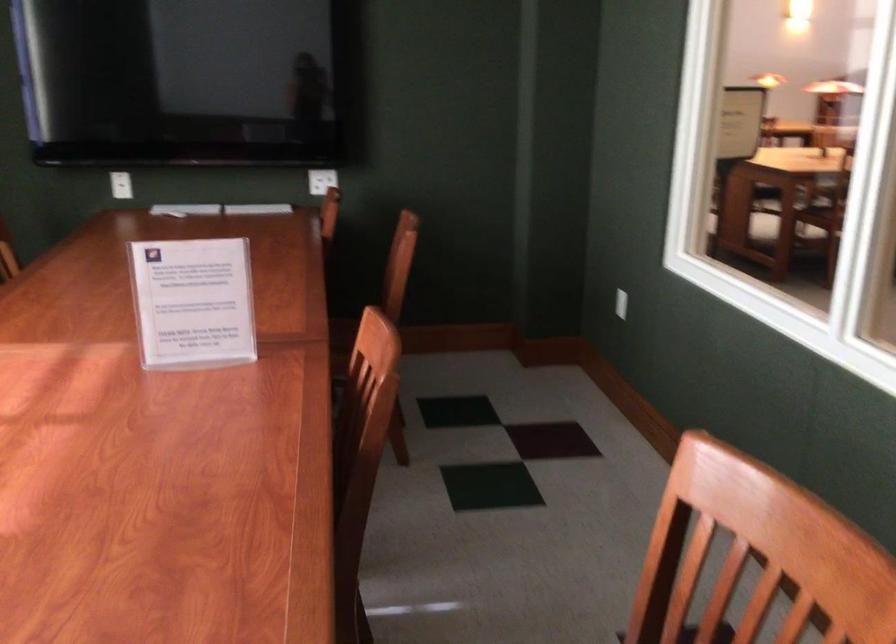
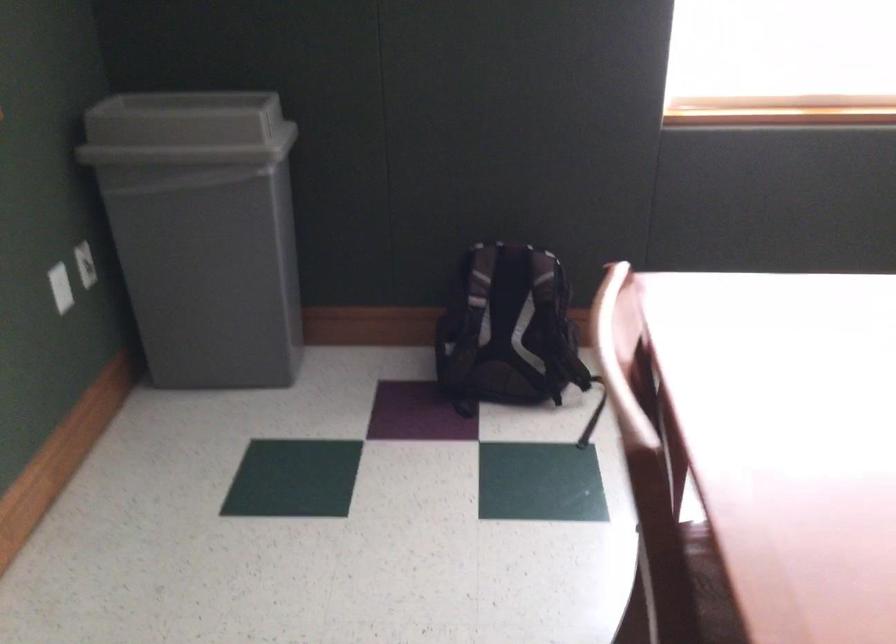
How did the camera likely rotate?

The camera rotated toward left-down.